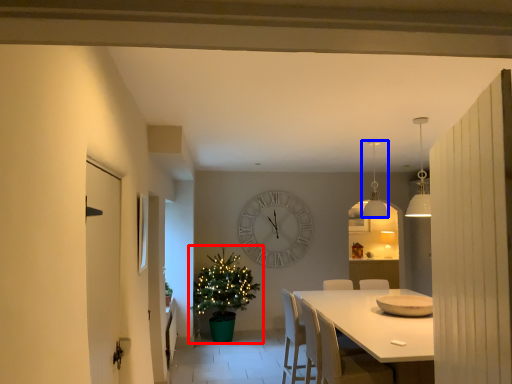
Question: Among these objects, which one is nearest to the camera, christmas tree (highlighted by a red box) or lamp (highlighted by a blue box)?

Choices:
 (A) christmas tree
 (B) lamp

Answer: (B)